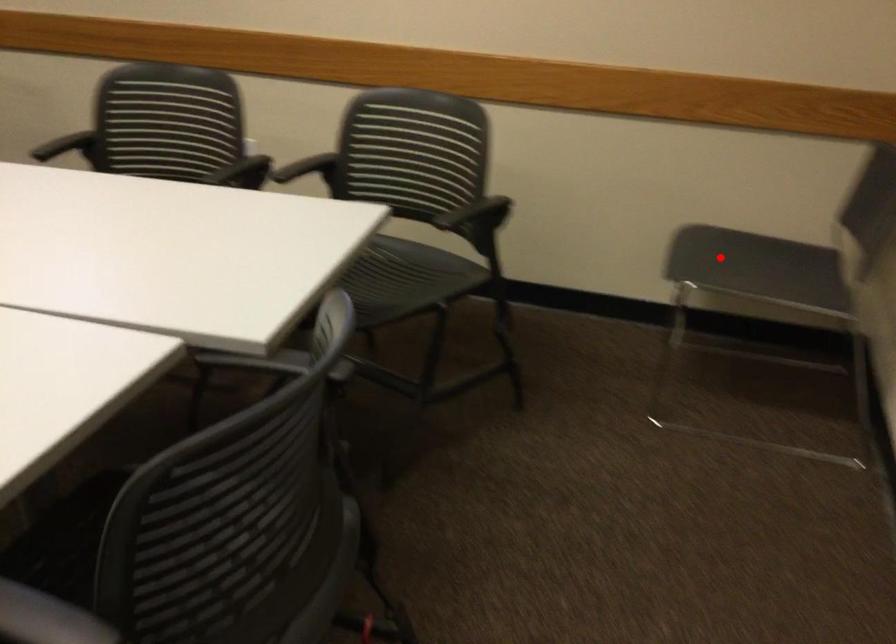
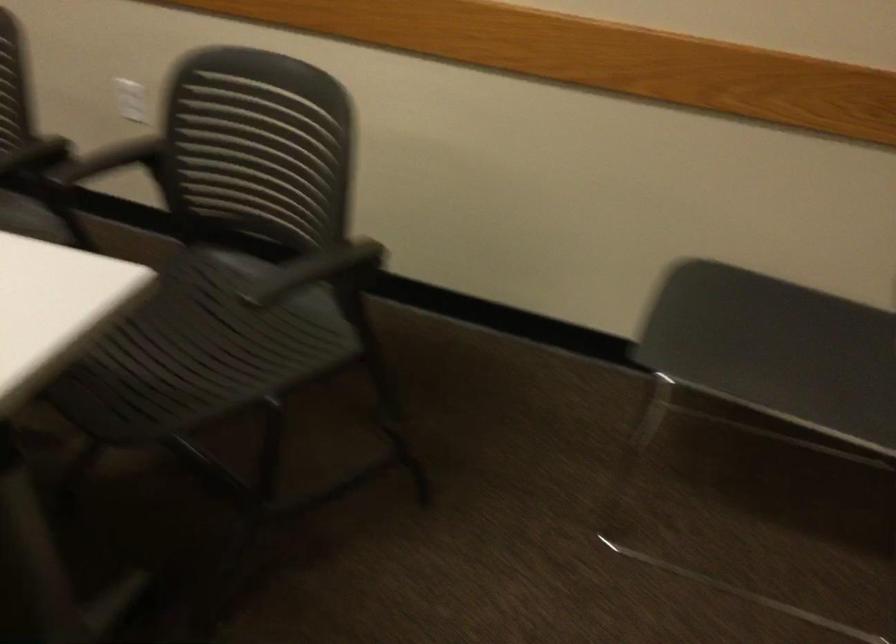
The point at the highlighted location is marked in the first image. Where is the corresponding point in the second image?

(714, 323)